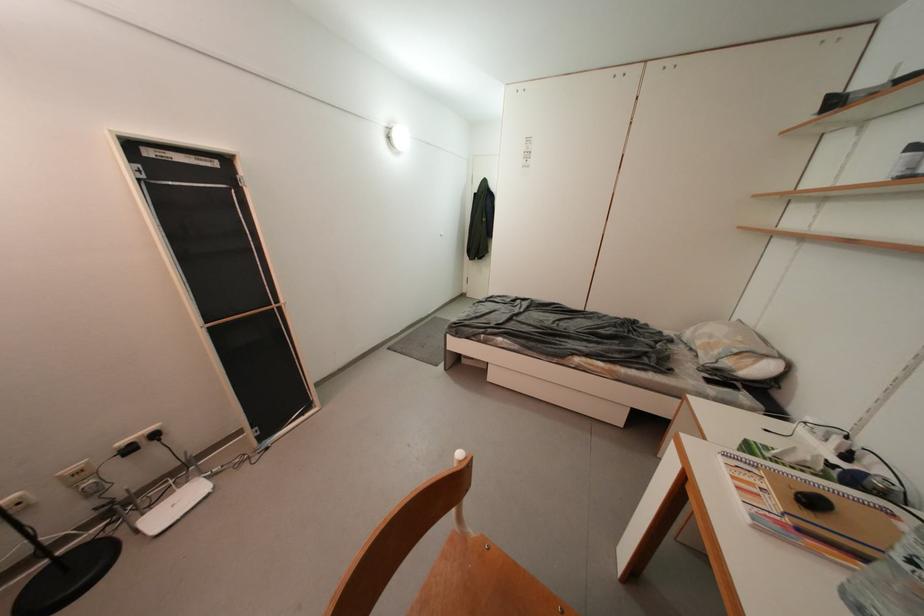
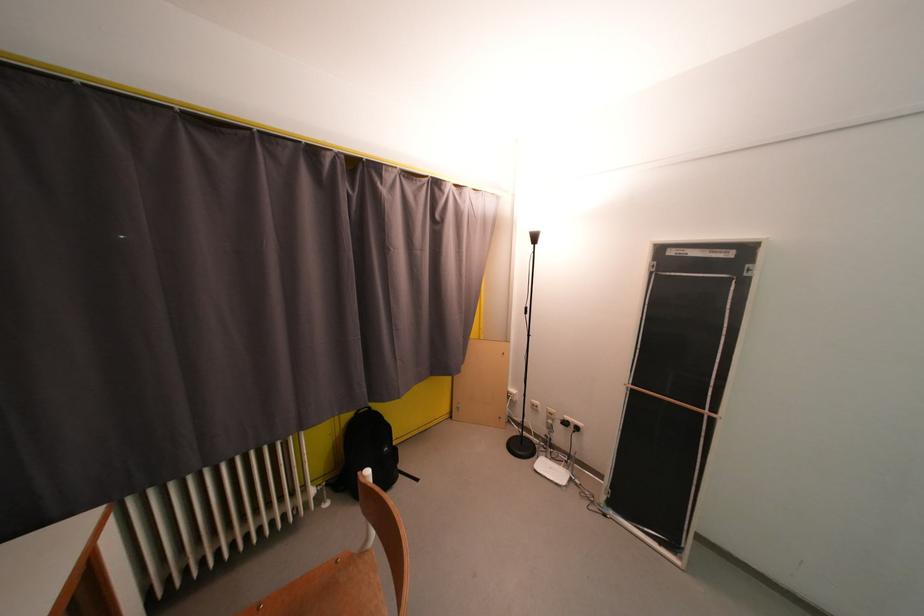
How did the camera likely rotate?

The camera's rotation is toward left-down.